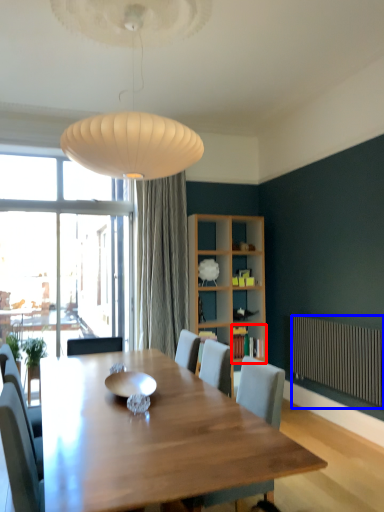
Question: Which of the following is the closest to the observer, shelf (highlighted by a red box) or radiator (highlighted by a blue box)?

Choices:
 (A) shelf
 (B) radiator

Answer: (B)